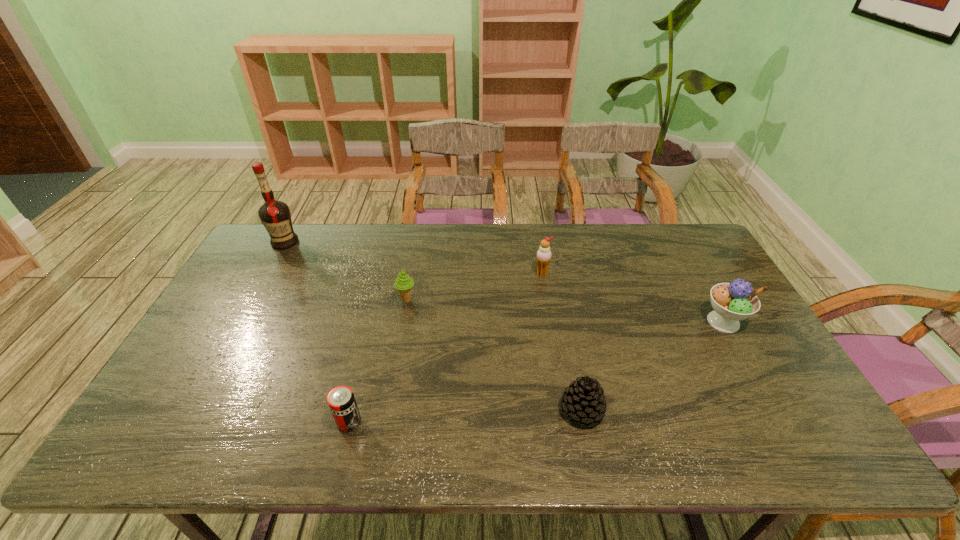
This screenshot has width=960, height=540. I want to click on icecream that stands as the closest to the fifth object from right to left, so click(403, 283).

What are the coordinates of `icecream that is the closest to the second icecream from right to left` in the screenshot? It's located at (403, 283).

Locate an element on the screen. The height and width of the screenshot is (540, 960). vacant space that satisfies the following two spatial constraints: 1. on the front and back of the can; 2. on the left side of the tallest object is located at coordinates (184, 422).

Where is `free space that satisfies the following two spatial constraints: 1. at the front with a straw on the rightmost object; 2. on the right side of the second icecream from right to left`? free space that satisfies the following two spatial constraints: 1. at the front with a straw on the rightmost object; 2. on the right side of the second icecream from right to left is located at coordinates (550, 322).